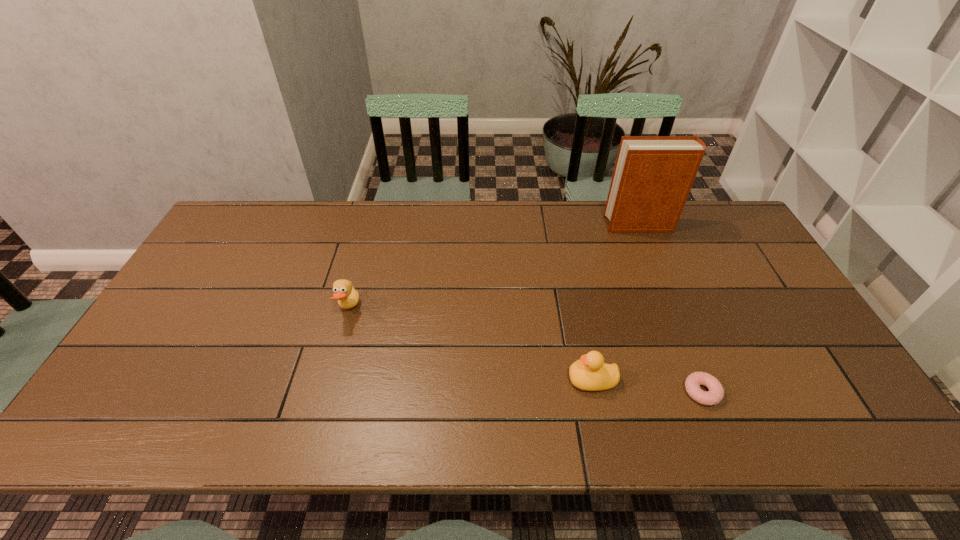
The width and height of the screenshot is (960, 540). Identify the location of free spot located 0.150m on the beak of the farther duck. (413, 309).

Locate an element on the screen. Image resolution: width=960 pixels, height=540 pixels. free space located on the face of the second object from left to right is located at coordinates (465, 380).

Where is `vacant space located 0.120m on the face of the second object from left to right`? The height and width of the screenshot is (540, 960). vacant space located 0.120m on the face of the second object from left to right is located at coordinates (518, 380).

I want to click on free space located 0.090m on the face of the second object from left to right, so click(531, 380).

Locate an element on the screen. free location located 0.080m on the back of the doughnut is located at coordinates [x=684, y=349].

Locate an element on the screen. Image resolution: width=960 pixels, height=540 pixels. object present at the far edge is located at coordinates (653, 175).

I want to click on object positioned at the near edge, so click(715, 395).

Where is `free space at the far edge of the desktop`? The height and width of the screenshot is (540, 960). free space at the far edge of the desktop is located at coordinates (396, 221).

Identify the location of free location at the near edge. (529, 417).

The width and height of the screenshot is (960, 540). I want to click on vacant position at the left edge of the desktop, so click(x=243, y=246).